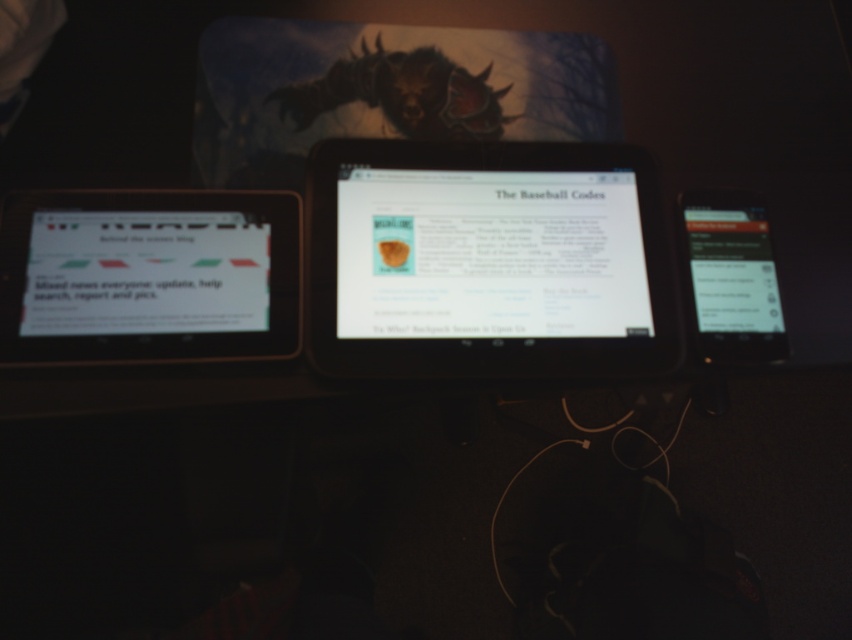
Can you confirm if white glossy tablet at center is positioned to the left of white glossy tablet at left?

Incorrect, white glossy tablet at center is not on the left side of white glossy tablet at left.

Is white glossy tablet at center taller than white glossy tablet at left?

Yes, white glossy tablet at center is taller than white glossy tablet at left.

Does point (423, 221) come in front of point (122, 294)?

No, (423, 221) is further to viewer.

Find the location of a particular element. The image size is (852, 640). white glossy tablet at center is located at coordinates (488, 253).

Can you confirm if white glossy tablet at left is shorter than black glossy tablet at right?

Correct, white glossy tablet at left is not as tall as black glossy tablet at right.

Between point (113, 314) and point (772, 346), which one is positioned behind?

The point (772, 346) is more distant.

You are a GUI agent. You are given a task and a screenshot of the screen. Output one action in this format:
    pyautogui.click(x=<x>, y=<y>)
    Task: Click on the white glossy tablet at left
    The image size is (852, 640).
    Given the screenshot: What is the action you would take?
    pyautogui.click(x=145, y=273)

Between white glossy tablet at center and black glossy tablet at right, which one appears on the right side from the viewer's perspective?

Positioned to the right is black glossy tablet at right.

Is white glossy tablet at center further to camera compared to black glossy tablet at right?

No, white glossy tablet at center is in front of black glossy tablet at right.

Who is more distant from viewer, (607, 324) or (766, 256)?

The point (766, 256) is behind.

Locate an element on the screen. The height and width of the screenshot is (640, 852). white glossy tablet at center is located at coordinates (488, 253).